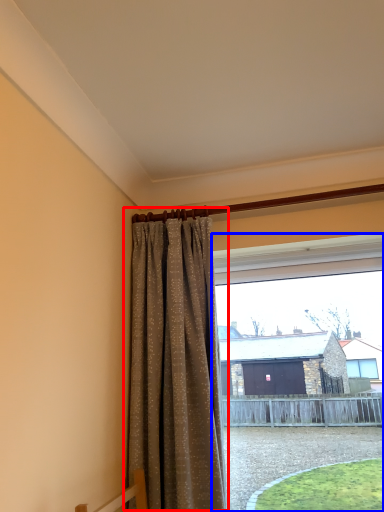
Question: Which of the following is the farthest to the observer, curtain (highlighted by a red box) or window (highlighted by a blue box)?

Choices:
 (A) curtain
 (B) window

Answer: (B)